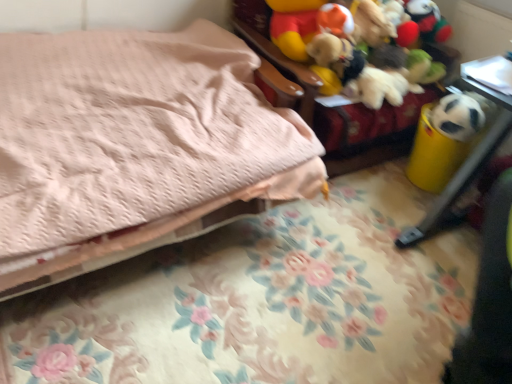
Measure the distance between point [228,143] and camera.

A distance of 1.60 meters exists between point [228,143] and camera.

You are a GUI agent. You are given a task and a screenshot of the screen. Output one action in this format:
    pyautogui.click(x=<x>, y=<y>)
    Task: Click on the soft fabric stuffed toys at upper right, which ranks as the 1th furniture in top-to-bottom order
    The height and width of the screenshot is (384, 512).
    Given the screenshot: What is the action you would take?
    pyautogui.click(x=336, y=107)

Where is `pink quilted bed at upper left`? The width and height of the screenshot is (512, 384). pink quilted bed at upper left is located at coordinates (140, 146).

How much distance is there between pink quilted bed at upper left and white matte panda at right?

The distance of pink quilted bed at upper left from white matte panda at right is 1.13 meters.

Which is behind, pink quilted bed at upper left or white matte panda at right?

white matte panda at right is behind.

Is there a large distance between pink quilted bed at upper left and white matte panda at right?

Indeed, pink quilted bed at upper left is not near white matte panda at right.

Looking at the image, does pink quilted bed at upper left seem bigger or smaller compared to white matte panda at right?

pink quilted bed at upper left is bigger than white matte panda at right.

Find the location of `furniture in front of the soft fabric stuffed toys at upper right, which ranks as the 1th furniture in top-to-bottom order`. furniture in front of the soft fabric stuffed toys at upper right, which ranks as the 1th furniture in top-to-bottom order is located at coordinates (476, 146).

From a real-world perspective, which is physically above, yellow plastic trash can at right, positioned as the 2th furniture in top-to-bottom order, or soft fabric stuffed toys at upper right, which ranks as the 1th furniture in top-to-bottom order?

soft fabric stuffed toys at upper right, which ranks as the 1th furniture in top-to-bottom order.

Is yellow plastic trash can at right, the 1th furniture from the bottom, oriented away from soft fabric stuffed toys at upper right, the 2th furniture in the bottom-to-top sequence?

No, yellow plastic trash can at right, the 1th furniture from the bottom, is not facing the opposite direction of soft fabric stuffed toys at upper right, the 2th furniture in the bottom-to-top sequence.

Considering the positions of objects yellow plastic trash can at right, positioned as the 2th furniture in top-to-bottom order, and soft fabric stuffed toys at upper right, the 2th furniture in the bottom-to-top sequence, in the image provided, who is more to the right, yellow plastic trash can at right, positioned as the 2th furniture in top-to-bottom order, or soft fabric stuffed toys at upper right, the 2th furniture in the bottom-to-top sequence,?

yellow plastic trash can at right, positioned as the 2th furniture in top-to-bottom order, is more to the right.

From the image's perspective, is white matte panda at right above or below soft fabric stuffed toys at upper right, which ranks as the 1th furniture in top-to-bottom order?

From the image's perspective, white matte panda at right appears below soft fabric stuffed toys at upper right, which ranks as the 1th furniture in top-to-bottom order.

Considering the positions of point (468, 119) and point (328, 132), is point (468, 119) closer or farther from the camera than point (328, 132)?

Point (468, 119) is closer to the camera than point (328, 132).

Is soft fabric stuffed toys at upper right, which ranks as the 1th furniture in top-to-bottom order, at the back of white matte panda at right?

No, white matte panda at right is not facing away from soft fabric stuffed toys at upper right, which ranks as the 1th furniture in top-to-bottom order.

Do you think white matte panda at right is within soft fabric stuffed toys at upper right, the 2th furniture in the bottom-to-top sequence, or outside of it?

white matte panda at right exists outside the volume of soft fabric stuffed toys at upper right, the 2th furniture in the bottom-to-top sequence.

Locate an element on the screen. This screenshot has height=384, width=512. animal that is behind the yellow plastic trash can at right, the 1th furniture from the bottom is located at coordinates (457, 117).

Which is in front, point (447, 133) or point (447, 202)?

The point (447, 202) is more forward.

From the image's perspective, between white matte panda at right and yellow plastic trash can at right, positioned as the 2th furniture in top-to-bottom order, who is located below?

yellow plastic trash can at right, positioned as the 2th furniture in top-to-bottom order, from the image's perspective.

You are a GUI agent. You are given a task and a screenshot of the screen. Output one action in this format:
    pyautogui.click(x=<x>, y=<y>)
    Task: Click on the bed on the left of yellow plastic trash can at right, the 1th furniture from the bottom
    
    Given the screenshot: What is the action you would take?
    pyautogui.click(x=140, y=146)

In the scene shown: What's the angular difference between pink quilted bed at upper left and yellow plastic trash can at right, the 1th furniture from the bottom,'s facing directions?

There is a 89.4-degree angle between the facing directions of pink quilted bed at upper left and yellow plastic trash can at right, the 1th furniture from the bottom.

Which object is more forward, pink quilted bed at upper left or yellow plastic trash can at right, the 1th furniture from the bottom?

pink quilted bed at upper left.

Considering the relative positions of pink quilted bed at upper left and yellow plastic trash can at right, the 1th furniture from the bottom, in the image provided, is pink quilted bed at upper left to the left or to the right of yellow plastic trash can at right, the 1th furniture from the bottom,?

pink quilted bed at upper left is to the left of yellow plastic trash can at right, the 1th furniture from the bottom.

Who is shorter, white matte panda at right or pink quilted bed at upper left?

white matte panda at right is shorter.

Which is more to the left, white matte panda at right or pink quilted bed at upper left?

Positioned to the left is pink quilted bed at upper left.

In order to click on animal lying behind the pink quilted bed at upper left in this screenshot , I will do `click(457, 117)`.

From a real-world perspective, starting from the pink quilted bed at upper left, which furniture is the 2nd one vertically above it? Please provide its 2D coordinates.

[(336, 107)]

Which point is more forward, (x=105, y=148) or (x=238, y=13)?

The point (x=105, y=148) is in front.

Could you tell me if pink quilted bed at upper left is turned towards soft fabric stuffed toys at upper right, which ranks as the 1th furniture in top-to-bottom order?

No, pink quilted bed at upper left is not turned towards soft fabric stuffed toys at upper right, which ranks as the 1th furniture in top-to-bottom order.

Who is more distant, pink quilted bed at upper left or soft fabric stuffed toys at upper right, which ranks as the 1th furniture in top-to-bottom order?

soft fabric stuffed toys at upper right, which ranks as the 1th furniture in top-to-bottom order, is further from the camera.

Locate an element on the screen. The height and width of the screenshot is (384, 512). animal above the pink quilted bed at upper left (from a real-world perspective) is located at coordinates pos(457,117).

This screenshot has height=384, width=512. What are the coordinates of `furniture that is below the soft fabric stuffed toys at upper right, which ranks as the 1th furniture in top-to-bottom order (from the image's perspective)` in the screenshot? It's located at (476, 146).

When comparing their distances from yellow plastic trash can at right, positioned as the 2th furniture in top-to-bottom order, does white matte panda at right or pink quilted bed at upper left seem closer?

white matte panda at right is closer to yellow plastic trash can at right, positioned as the 2th furniture in top-to-bottom order.

Estimate the real-world distances between objects in this image. Which object is further from pink quilted bed at upper left, white matte panda at right or soft fabric stuffed toys at upper right, the 2th furniture in the bottom-to-top sequence?

Among the two, white matte panda at right is located further to pink quilted bed at upper left.

Considering their positions, is soft fabric stuffed toys at upper right, the 2th furniture in the bottom-to-top sequence, positioned further to yellow plastic trash can at right, the 1th furniture from the bottom, than pink quilted bed at upper left?

Based on the image, pink quilted bed at upper left appears to be further to yellow plastic trash can at right, the 1th furniture from the bottom.

Which object lies further to the anchor point pink quilted bed at upper left, white matte panda at right or yellow plastic trash can at right, the 1th furniture from the bottom?

Based on the image, white matte panda at right appears to be further to pink quilted bed at upper left.

Which object lies nearer to the anchor point yellow plastic trash can at right, the 1th furniture from the bottom, pink quilted bed at upper left or soft fabric stuffed toys at upper right, which ranks as the 1th furniture in top-to-bottom order?

soft fabric stuffed toys at upper right, which ranks as the 1th furniture in top-to-bottom order, is positioned closer to the anchor yellow plastic trash can at right, the 1th furniture from the bottom.

From the image, which object appears to be farther from white matte panda at right, pink quilted bed at upper left or soft fabric stuffed toys at upper right, the 2th furniture in the bottom-to-top sequence?

pink quilted bed at upper left is further to white matte panda at right.

From the image, which object appears to be nearer to white matte panda at right, soft fabric stuffed toys at upper right, the 2th furniture in the bottom-to-top sequence, or pink quilted bed at upper left?

Among the two, soft fabric stuffed toys at upper right, the 2th furniture in the bottom-to-top sequence, is located nearer to white matte panda at right.

Estimate the real-world distances between objects in this image. Which object is further from yellow plastic trash can at right, positioned as the 2th furniture in top-to-bottom order, pink quilted bed at upper left or white matte panda at right?

pink quilted bed at upper left.

Locate an element on the screen. animal between soft fabric stuffed toys at upper right, the 2th furniture in the bottom-to-top sequence, and yellow plastic trash can at right, positioned as the 2th furniture in top-to-bottom order, vertically is located at coordinates (457, 117).

I want to click on furniture between pink quilted bed at upper left and white matte panda at right from left to right, so click(x=336, y=107).

Locate an element on the screen. This screenshot has width=512, height=384. furniture situated between pink quilted bed at upper left and yellow plastic trash can at right, the 1th furniture from the bottom, from left to right is located at coordinates (336, 107).

Identify the location of animal situated between pink quilted bed at upper left and yellow plastic trash can at right, positioned as the 2th furniture in top-to-bottom order, from left to right. (457, 117).